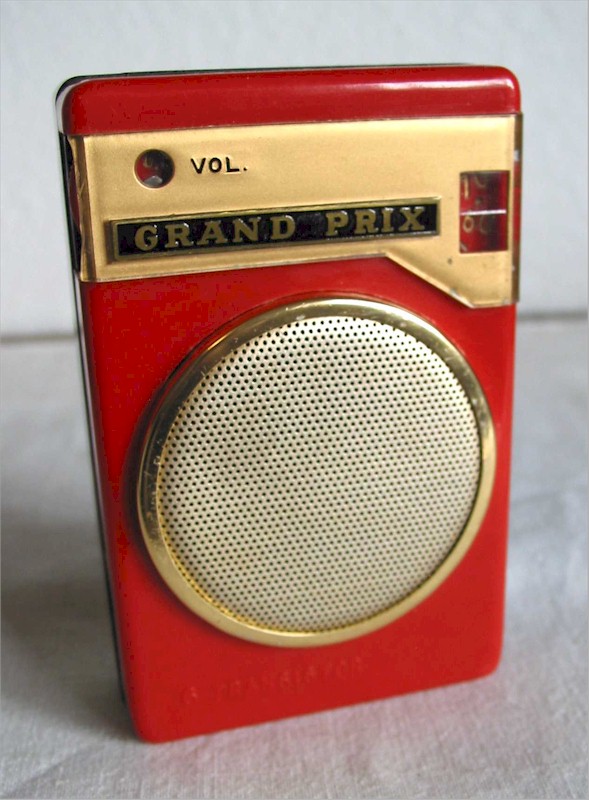
This screenshot has width=589, height=800. I want to click on spot where the counter and wall beet, so click(x=545, y=316), click(x=31, y=338).